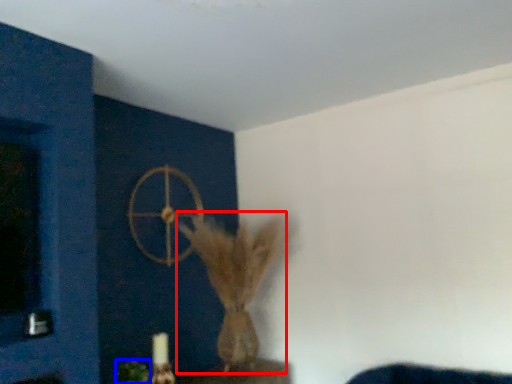
Question: Among these objects, which one is farthest to the camera, animal (highlighted by a red box) or plant (highlighted by a blue box)?

Choices:
 (A) animal
 (B) plant

Answer: (A)